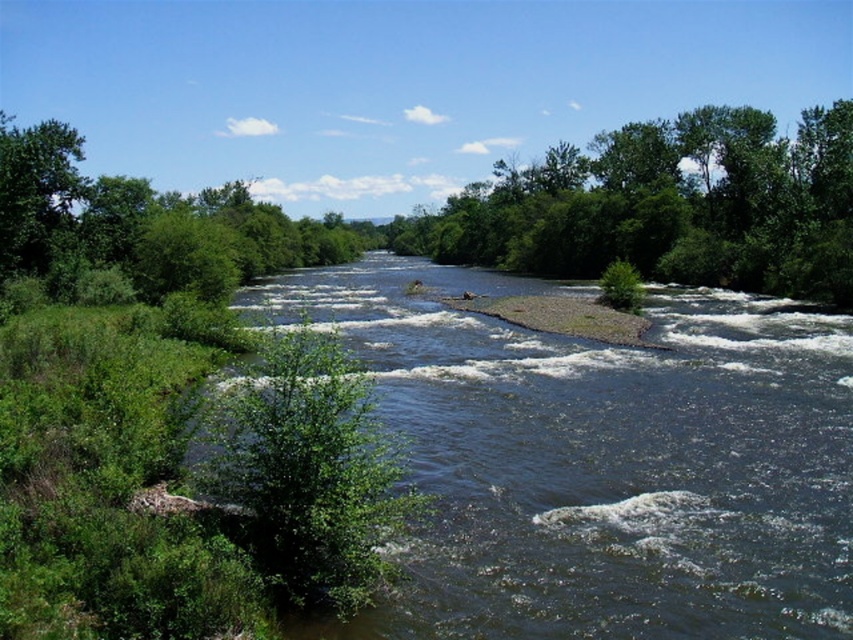
Is dark blue water at center positioned in front of green leafy tree at left?

Yes, dark blue water at center is closer to the viewer.

Is dark blue water at center to the left of green leafy tree at left from the viewer's perspective?

Incorrect, dark blue water at center is not on the left side of green leafy tree at left.

Between point (401, 618) and point (345, 557), which one is positioned in front?

Point (345, 557) is more forward.

Where is `dark blue water at center`? This screenshot has width=853, height=640. dark blue water at center is located at coordinates (601, 461).

Does green leafy tree at center lie behind green leafy tree at left?

Yes, it is.

Which of these two, green leafy tree at center or green leafy tree at left, stands taller?

With more height is green leafy tree at center.

At what (x,y) coordinates should I click in order to perform the action: click on green leafy tree at center. Please return your answer as a coordinate pair (x, y). The width and height of the screenshot is (853, 640). Looking at the image, I should click on (668, 205).

This screenshot has height=640, width=853. I want to click on green leafy tree at center, so click(x=668, y=205).

Between dark blue water at center and green leafy tree at center, which one appears on the right side from the viewer's perspective?

Positioned to the right is green leafy tree at center.

Image resolution: width=853 pixels, height=640 pixels. I want to click on dark blue water at center, so click(x=601, y=461).

Image resolution: width=853 pixels, height=640 pixels. In order to click on dark blue water at center in this screenshot , I will do `click(601, 461)`.

Locate an element on the screen. This screenshot has width=853, height=640. dark blue water at center is located at coordinates (601, 461).